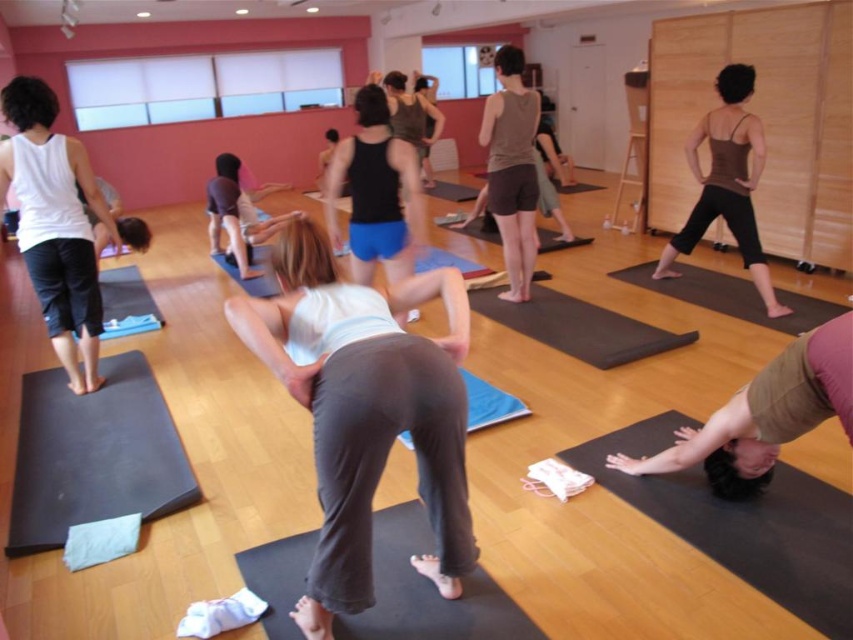
Question: Which object is the closest to the dark gray rubber yoga mat at lower right?

Choices:
 (A) matte brown tank top at center
 (B) black matte tank top at center
 (C) black rubber yoga mat at lower left

Answer: (A)

Question: Which is farther from the black rubber yoga mat at lower left?

Choices:
 (A) white cotton tank top at left
 (B) blue rubber yoga mat at lower left
 (C) matte brown tank top at center
 (D) dark gray rubber yoga mat at lower right

Answer: (C)

Question: Observing the image, what is the correct spatial positioning of black rubber yoga mat at lower right in reference to black rubber mat at center?

Choices:
 (A) left
 (B) right

Answer: (B)

Question: Does light blue fabric at center have a greater width compared to black rubber yoga mat at lower left?

Choices:
 (A) no
 (B) yes

Answer: (A)

Question: Is black rubber yoga mat at lower left smaller than black rubber yoga mat at center?

Choices:
 (A) yes
 (B) no

Answer: (B)

Question: Considering the real-world distances, which object is closest to the black rubber mat at center?

Choices:
 (A) black rubber yoga mat at lower right
 (B) black matte tank top at center
 (C) dark gray rubber yoga mat at lower right

Answer: (C)